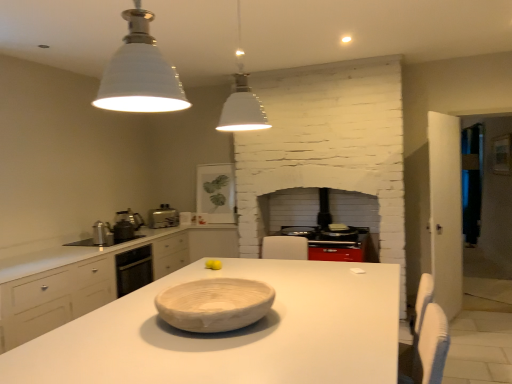
Question: Is the position of metallic silver kettle at left, the second appliance when ordered from front to back, less distant than that of matte white framed picture at upper center, the fifth appliance viewed from the front?

Choices:
 (A) yes
 (B) no

Answer: (A)

Question: From a real-world perspective, is metallic silver kettle at left, which is the third appliance in right-to-left order, beneath matte white framed picture at upper center, marked as the second appliance in a right-to-left arrangement?

Choices:
 (A) no
 (B) yes

Answer: (B)

Question: Can you confirm if metallic silver kettle at left, the third appliance when ordered from left to right, is positioned to the left of matte white framed picture at upper center, which is the 1th appliance from back to front?

Choices:
 (A) no
 (B) yes

Answer: (B)

Question: Considering the relative sizes of metallic silver kettle at left, the second appliance when ordered from front to back, and matte white framed picture at upper center, marked as the second appliance in a right-to-left arrangement, in the image provided, is metallic silver kettle at left, the second appliance when ordered from front to back, shorter than matte white framed picture at upper center, marked as the second appliance in a right-to-left arrangement,?

Choices:
 (A) yes
 (B) no

Answer: (A)

Question: From a real-world perspective, does metallic silver kettle at left, the second appliance when ordered from front to back, stand above matte white framed picture at upper center, marked as the second appliance in a right-to-left arrangement?

Choices:
 (A) no
 (B) yes

Answer: (A)

Question: In the image, is natural wood bowl at center positioned in front of or behind yellow matte tennis ball at center?

Choices:
 (A) front
 (B) behind

Answer: (A)

Question: Is natural wood bowl at center bigger or smaller than yellow matte tennis ball at center?

Choices:
 (A) big
 (B) small

Answer: (A)

Question: From a real-world perspective, is natural wood bowl at center above or below yellow matte tennis ball at center?

Choices:
 (A) above
 (B) below

Answer: (A)

Question: In terms of width, does natural wood bowl at center look wider or thinner when compared to yellow matte tennis ball at center?

Choices:
 (A) thin
 (B) wide

Answer: (B)

Question: From their relative heights in the image, would you say yellow matte tennis ball at center is taller or shorter than metallic silver toaster at center-left?

Choices:
 (A) tall
 (B) short

Answer: (B)

Question: In the image, is yellow matte tennis ball at center on the left side or the right side of metallic silver toaster at center-left?

Choices:
 (A) right
 (B) left

Answer: (A)

Question: Would you say yellow matte tennis ball at center is inside or outside metallic silver toaster at center-left?

Choices:
 (A) inside
 (B) outside

Answer: (B)

Question: Is point (217, 261) closer or farther from the camera than point (175, 225)?

Choices:
 (A) closer
 (B) farther

Answer: (A)

Question: In terms of height, does white matte pendant light at upper center, the 1th light fixture when ordered from back to front, look taller or shorter compared to natural wood bowl at center?

Choices:
 (A) tall
 (B) short

Answer: (A)

Question: Is white matte pendant light at upper center, the 1th light fixture when ordered from back to front, situated inside natural wood bowl at center or outside?

Choices:
 (A) inside
 (B) outside

Answer: (B)